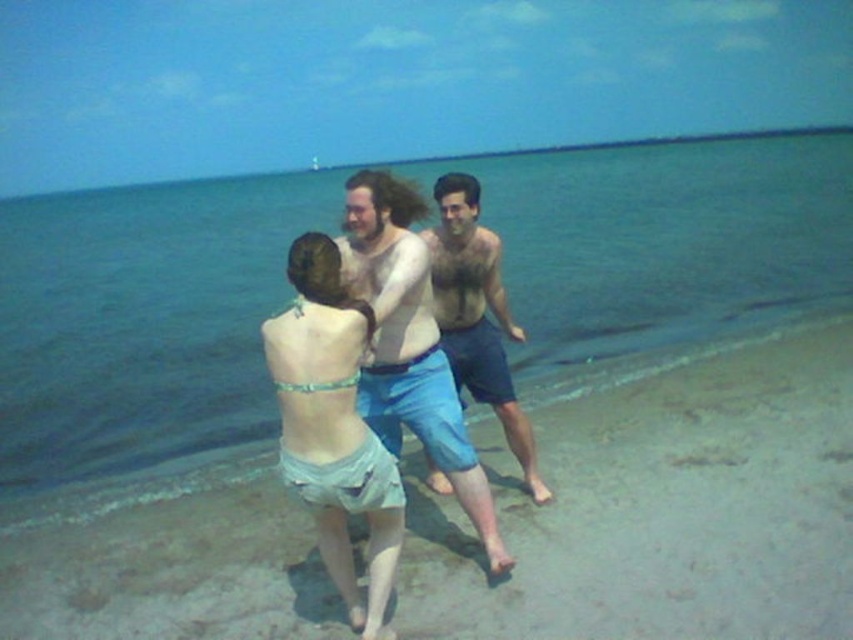
Question: Can you confirm if light brown sand at lower center is positioned to the right of shiny blue shorts at center?

Choices:
 (A) no
 (B) yes

Answer: (A)

Question: Does clear blue water at center have a smaller size compared to light blue denim shorts at center?

Choices:
 (A) no
 (B) yes

Answer: (A)

Question: Among these objects, which one is farthest from the camera?

Choices:
 (A) muscular tan skin at center
 (B) clear blue water at center
 (C) light blue fabric bikini top at center

Answer: (A)

Question: Does shiny blue shorts at center have a lesser width compared to muscular tan skin at center?

Choices:
 (A) yes
 (B) no

Answer: (B)

Question: Among these points, which one is nearest to the camera?

Choices:
 (A) (407, 211)
 (B) (170, 552)

Answer: (A)

Question: Which point is closer to the camera?

Choices:
 (A) light blue denim shorts at center
 (B) light blue fabric bikini top at center
 (C) muscular tan skin at center

Answer: (A)